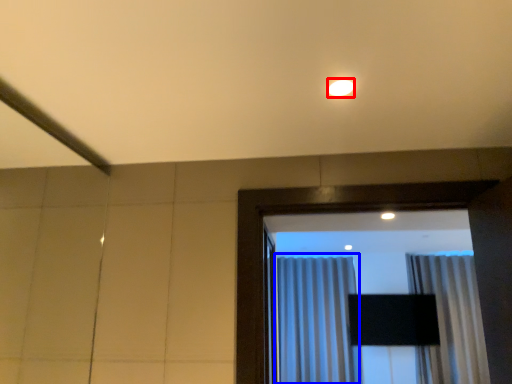
Question: Which object is closer to the camera taking this photo, lighting (highlighted by a red box) or curtain (highlighted by a blue box)?

Choices:
 (A) lighting
 (B) curtain

Answer: (A)